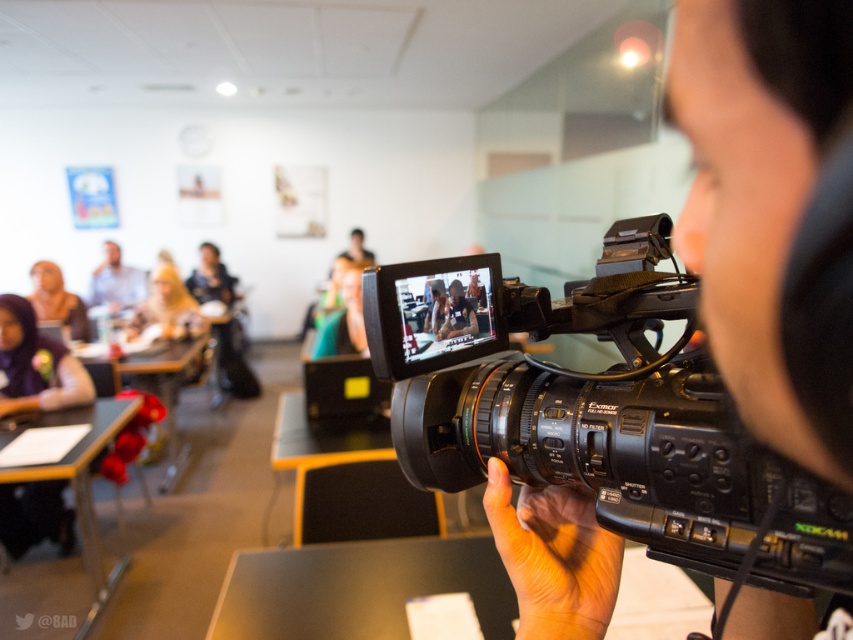
Question: Does black matte table at lower center appear on the right side of wooden table at center?

Choices:
 (A) no
 (B) yes

Answer: (B)

Question: Is black plastic video camera at center thinner than wooden table at lower left?

Choices:
 (A) no
 (B) yes

Answer: (B)

Question: Which is nearer to the matte black laptop at upper center?

Choices:
 (A) wooden table at center
 (B) matte white shirt at upper left

Answer: (B)

Question: Among these objects, which one is farthest from the camera?

Choices:
 (A) black matte table at lower center
 (B) matte black laptop at upper center

Answer: (B)

Question: Where is black plastic video camera at center located in relation to matte black hijab at upper center in the image?

Choices:
 (A) right
 (B) left

Answer: (A)

Question: Which point is closer to the camera taking this photo?

Choices:
 (A) (91, 285)
 (B) (74, 500)
 (C) (366, 324)

Answer: (C)